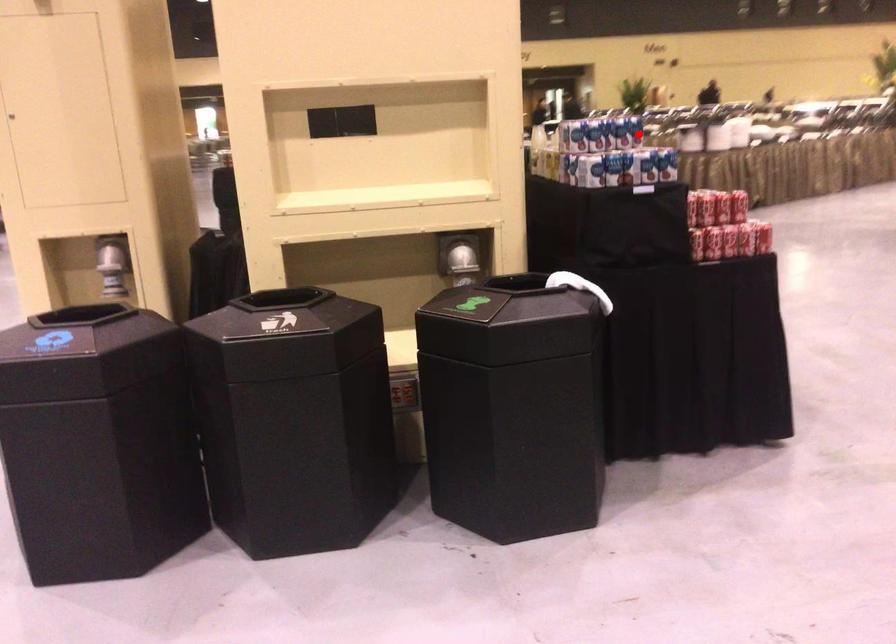
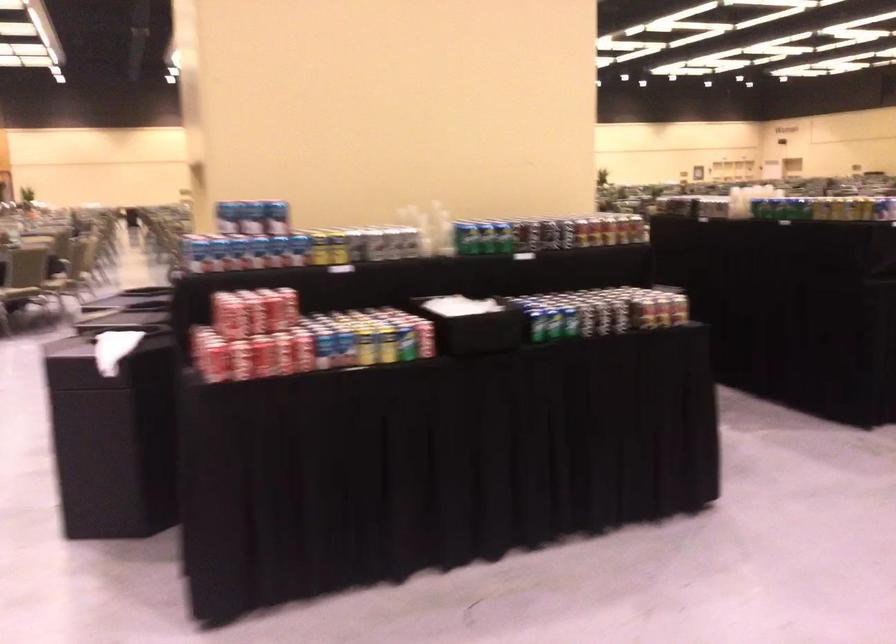
Where in the second image is the point corresponding to the highlighted location from the first image?

(277, 218)